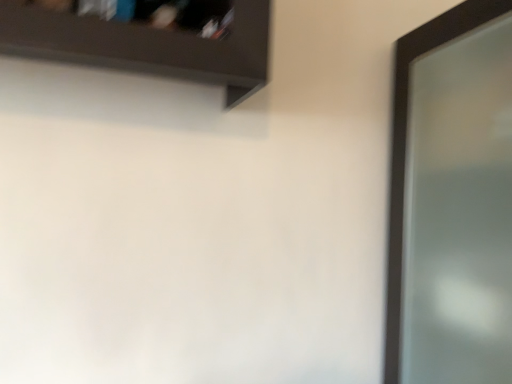
Question: Is clear glass screen door at right completely or partially inside dark brown wooden shelf at upper left?

Choices:
 (A) yes
 (B) no

Answer: (B)

Question: Is dark brown wooden shelf at upper left positioned beyond the bounds of clear glass screen door at right?

Choices:
 (A) no
 (B) yes

Answer: (B)

Question: Does dark brown wooden shelf at upper left appear on the left side of clear glass screen door at right?

Choices:
 (A) no
 (B) yes

Answer: (B)

Question: From the image's perspective, would you say dark brown wooden shelf at upper left is positioned over clear glass screen door at right?

Choices:
 (A) no
 (B) yes

Answer: (B)

Question: From a real-world perspective, does dark brown wooden shelf at upper left sit lower than clear glass screen door at right?

Choices:
 (A) yes
 (B) no

Answer: (B)

Question: Is dark brown wooden shelf at upper left beside clear glass screen door at right?

Choices:
 (A) yes
 (B) no

Answer: (B)

Question: Can you confirm if clear glass screen door at right is smaller than dark brown wooden shelf at upper left?

Choices:
 (A) no
 (B) yes

Answer: (A)

Question: From the image's perspective, is clear glass screen door at right on dark brown wooden shelf at upper left?

Choices:
 (A) yes
 (B) no

Answer: (B)

Question: Are clear glass screen door at right and dark brown wooden shelf at upper left far apart?

Choices:
 (A) yes
 (B) no

Answer: (B)

Question: From the image's perspective, does clear glass screen door at right appear lower than dark brown wooden shelf at upper left?

Choices:
 (A) no
 (B) yes

Answer: (B)

Question: Is dark brown wooden shelf at upper left at the back of clear glass screen door at right?

Choices:
 (A) no
 (B) yes

Answer: (A)

Question: Does clear glass screen door at right appear on the right side of dark brown wooden shelf at upper left?

Choices:
 (A) yes
 (B) no

Answer: (A)

Question: From a real-world perspective, is dark brown wooden shelf at upper left positioned above or below clear glass screen door at right?

Choices:
 (A) above
 (B) below

Answer: (A)